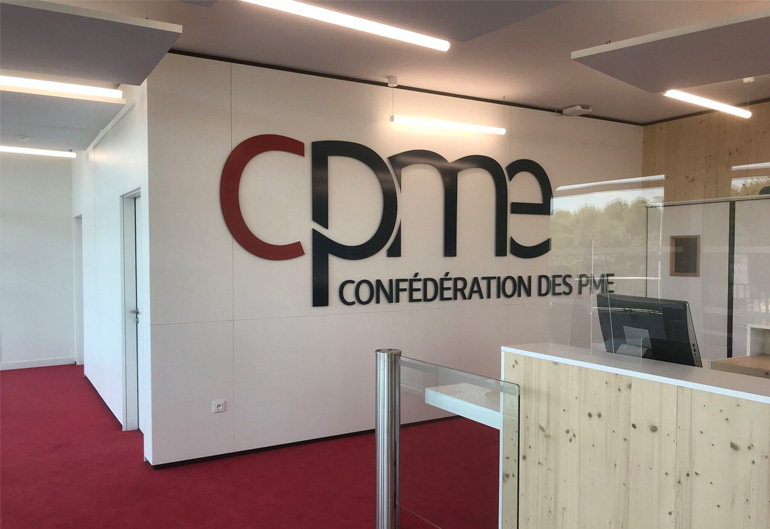
I want to click on 5 lights, so point(69,94), point(15,141), point(322,28), point(437,126), point(718,105).